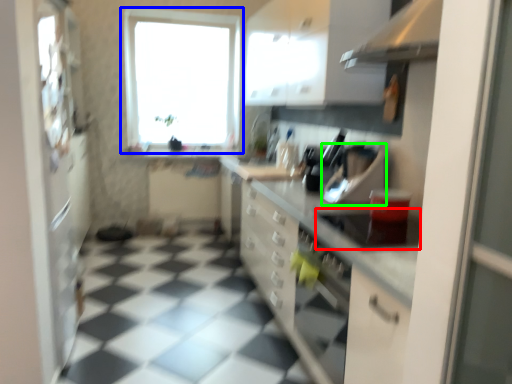
Question: Considering the real-world distances, which object is closest to appliance (highlighted by a red box)? window (highlighted by a blue box) or appliance (highlighted by a green box).

Choices:
 (A) window
 (B) appliance

Answer: (B)